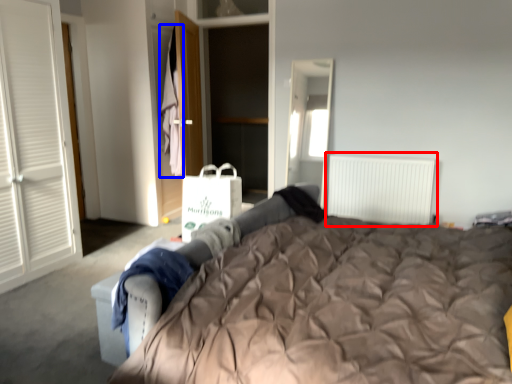
Question: Which object appears farthest to the camera in this image, radiator (highlighted by a red box) or laundry (highlighted by a blue box)?

Choices:
 (A) radiator
 (B) laundry

Answer: (B)